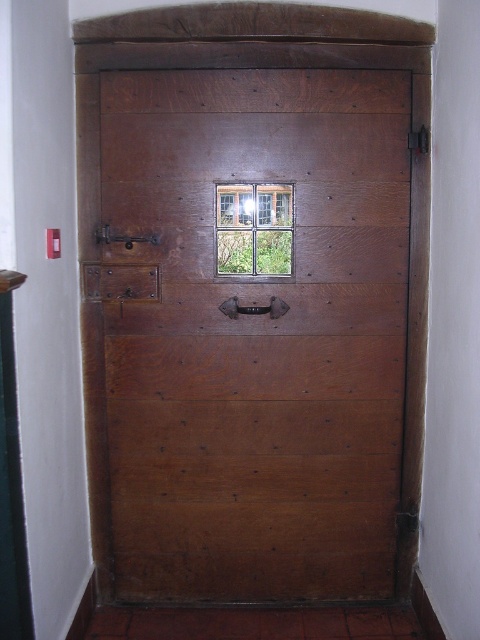
Looking at this image, you are a delivery person standing in front of a matte wood door at center. You need to deliver a package that requires you to press a button located 1.8 meters above the ground. Can you reach the button without any assistance?

The matte wood door at center is 2.08 meters away from viewer, so the distance from you to the door is 2.08 meters. However, the height of the button is 1.8 meters above the ground. Since the question is about vertical reach, the horizontal distance to the door does not affect your ability to reach the button. If your arm can reach up to 1.8 meters or higher, you can press the button. The answer depends on your personal reach height, but the door distance itself does not hinder reaching the button.

You are trying to enter the room and see the matte wood door at center and the wooden textured window at center. Which object is closer to you?

The matte wood door at center is closer to you because it is in front of the wooden textured window at center.

You are standing in front of the wooden door with two metal hinges on the right side. You notice two points marked on the door. One is at coordinate point (240, 294) and the other at point (218, 240). Which point is closer to you?

Point (218, 240) is closer to you because it is in front of point (240, 294).